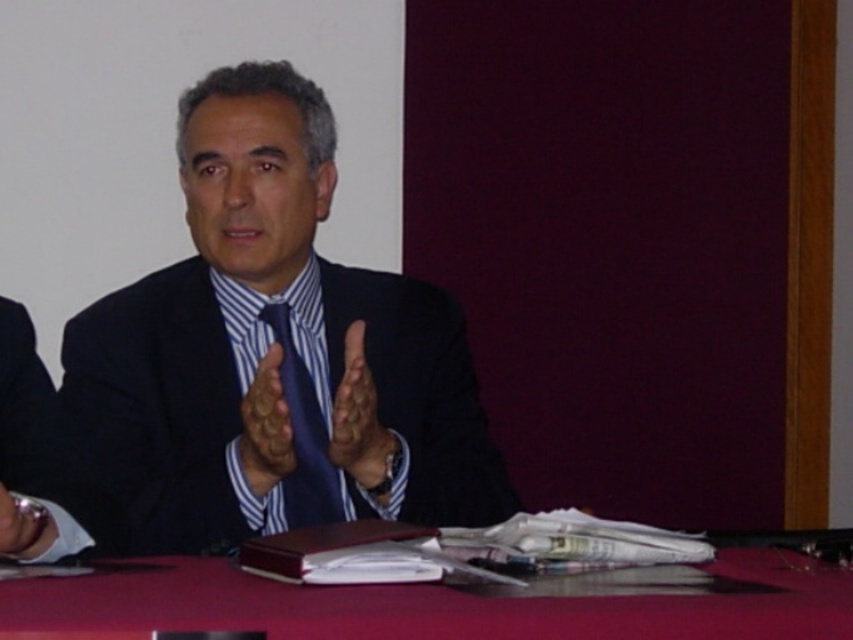
You are an event planner organizing a formal dinner. You need to ensure that the blue silk tie at center and the matte black hand at center can both fit on a decorative plate that is 15 cm in diameter. Based on their sizes, will they both fit together?

The blue silk tie at center is wider than the matte black hand at center. However, since the exact dimensions of each are not provided, we cannot definitively determine if they will both fit on a 15 cm diameter plate. More information about their individual sizes is needed.

You are an event planner observing a speaker at a conference. You notice the speaker has a blue silk tie at center and a matte black hand at center. From your perspective, which object is closer to you?

The blue silk tie at center is closer to you because the matte black hand at center is behind it.